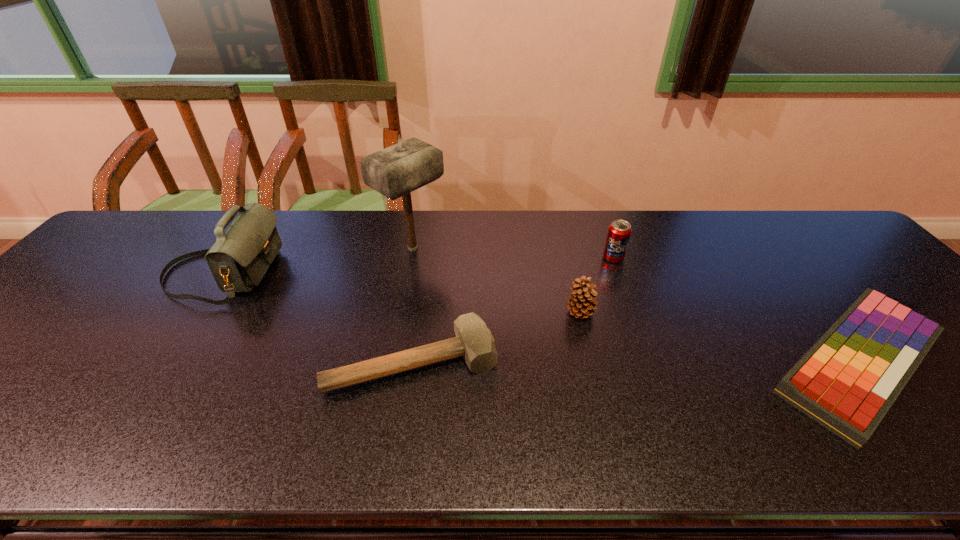
This screenshot has width=960, height=540. I want to click on free space between the taller mallet and the shorter mallet, so click(x=413, y=305).

This screenshot has width=960, height=540. What are the coordinates of `free space between the nearer mallet and the leftmost object` in the screenshot? It's located at (317, 318).

Locate an element on the screen. The height and width of the screenshot is (540, 960). blank region between the shoulder bag and the shorter mallet is located at coordinates (317, 318).

This screenshot has width=960, height=540. Find the location of `vacant area that lies between the second object from right to left and the leftmost object`. vacant area that lies between the second object from right to left and the leftmost object is located at coordinates (418, 266).

You are a GUI agent. You are given a task and a screenshot of the screen. Output one action in this format:
    pyautogui.click(x=<x>, y=<y>)
    Task: Click on the vacant space in between the shorter mallet and the pinecone
    
    Given the screenshot: What is the action you would take?
    pyautogui.click(x=496, y=337)

Identify which object is the fourth closest to the shortest object. Please provide its 2D coordinates. Your answer should be formatted as a tuple, i.e. [(x, y)], where the tuple contains the x and y coordinates of a point satisfying the conditions above.

[(396, 171)]

Find the location of `object identified as the closest to the rightmost object`. object identified as the closest to the rightmost object is located at coordinates (619, 231).